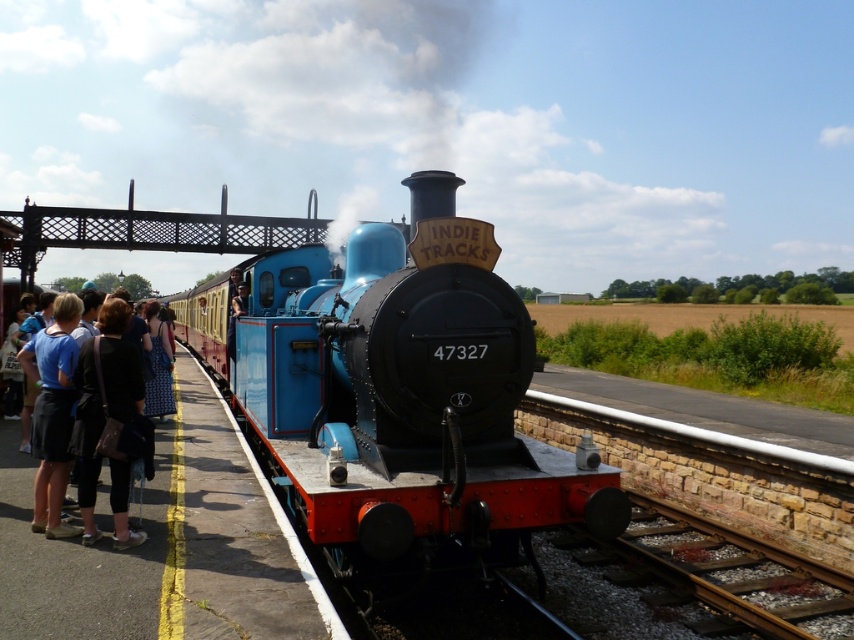
Question: Can you confirm if black fabric bag at left is smaller than matte blue skirt at left?

Choices:
 (A) yes
 (B) no

Answer: (A)

Question: Which is nearer to the dark blue denim jeans at left?

Choices:
 (A) blue polished wood train at center
 (B) smoketransparentatupper center
 (C) matte blue skirt at left
 (D) black fabric bag at left

Answer: (D)

Question: Which point is closer to the camera?

Choices:
 (A) (331, 349)
 (B) (80, 394)
 (C) (305, 104)

Answer: (B)

Question: Estimate the real-world distances between objects in this image. Which object is farther from the black fabric bag at left?

Choices:
 (A) blue polished wood train at center
 (B) matte blue skirt at left
 (C) dark blue denim jeans at left
 (D) smoketransparentatupper center

Answer: (D)

Question: Is smoketransparentatupper center bigger than black fabric bag at left?

Choices:
 (A) yes
 (B) no

Answer: (A)

Question: Is smoketransparentatupper center bigger than matte blue skirt at left?

Choices:
 (A) no
 (B) yes

Answer: (B)